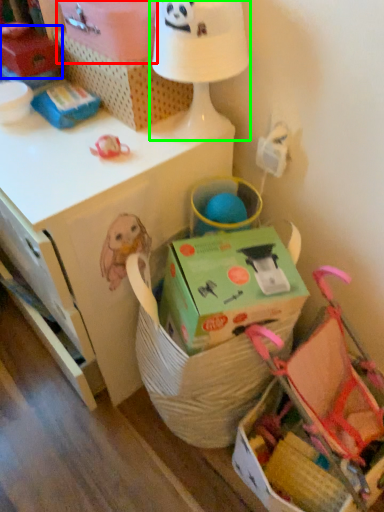
Question: Which object is positioned farthest from cardboard box (highlighted by a red box)? Select from storage box (highlighted by a blue box) and table lamp (highlighted by a green box).

Choices:
 (A) storage box
 (B) table lamp

Answer: (A)